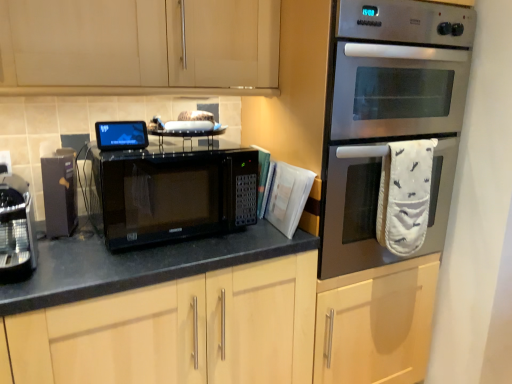
You are a GUI agent. You are given a task and a screenshot of the screen. Output one action in this format:
    pyautogui.click(x=<x>, y=<y>)
    Task: Click on the vacant area that lies between black matte microwave at center and sleek metallic coffee machine at left, the 3th appliance in the right-to-left sequence
    The width and height of the screenshot is (512, 384).
    Given the screenshot: What is the action you would take?
    pyautogui.click(x=83, y=251)